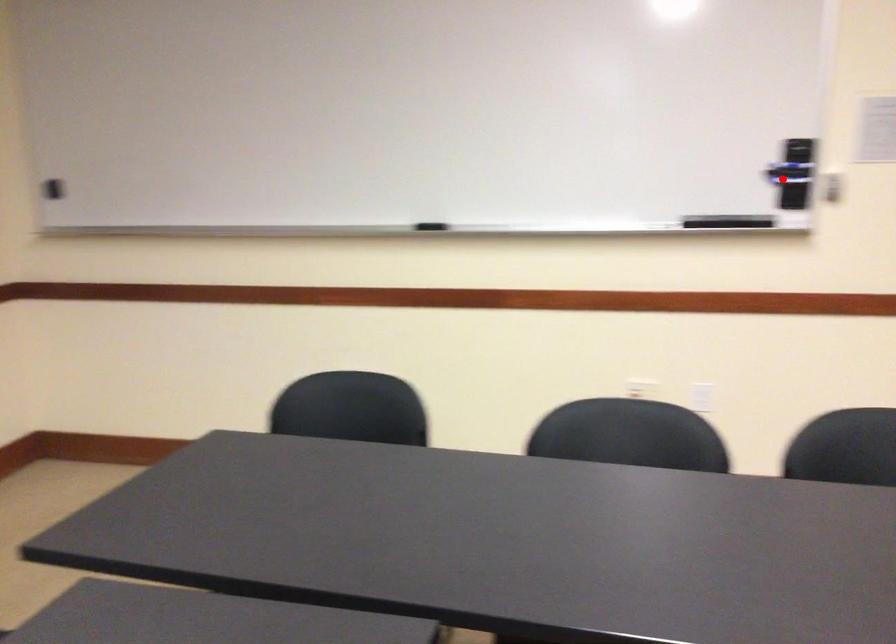
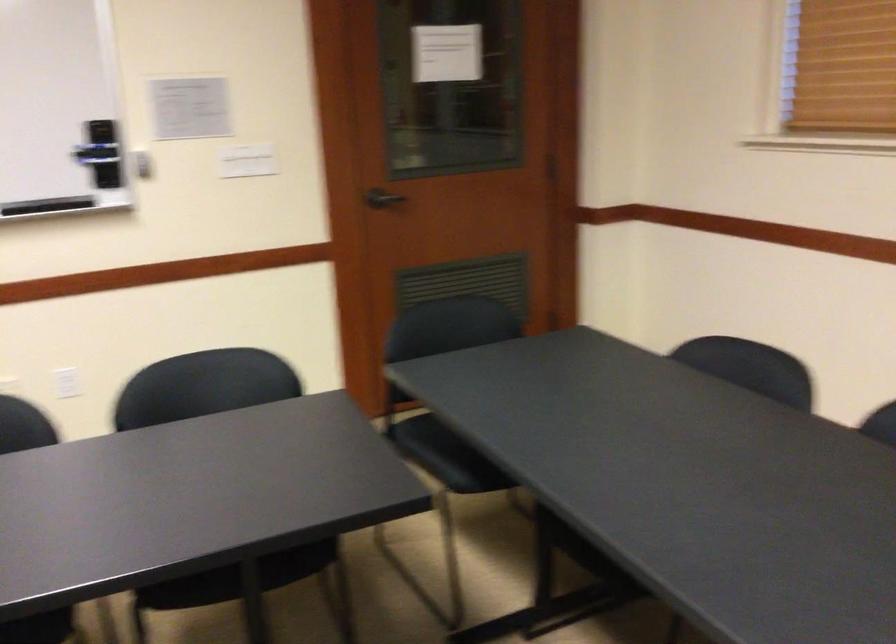
Find the pixel in the second image that matches the highlighted location in the first image.

(100, 153)